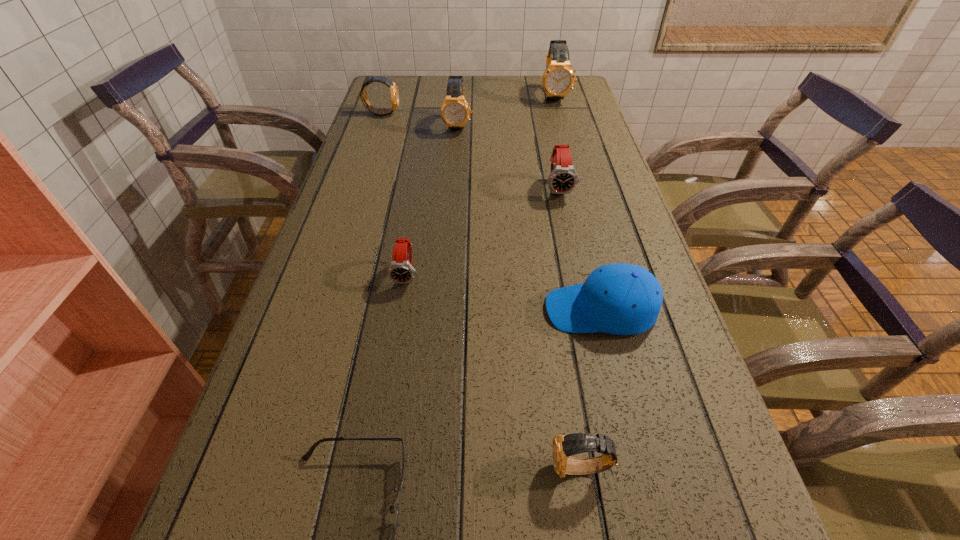
This screenshot has width=960, height=540. I want to click on the smallest gold watch, so click(563, 447).

You are a GUI agent. You are given a task and a screenshot of the screen. Output one action in this format:
    pyautogui.click(x=<x>, y=<y>)
    Task: Click on the fifth farthest watch
    
    Given the screenshot: What is the action you would take?
    pyautogui.click(x=400, y=270)

Locate an element on the screen. The image size is (960, 540). the smaller red watch is located at coordinates (400, 270).

Find the location of `vacant space located 0.090m on the face of the farthest object`. vacant space located 0.090m on the face of the farthest object is located at coordinates (561, 120).

Image resolution: width=960 pixels, height=540 pixels. In order to click on vacant space located 0.110m on the face of the second gold watch from left to right in this screenshot , I will do `click(456, 156)`.

In order to click on free space located on the face of the second smallest gold watch in this screenshot , I will do `click(442, 113)`.

This screenshot has width=960, height=540. Find the location of `free space located 0.210m on the face of the farther red watch`. free space located 0.210m on the face of the farther red watch is located at coordinates (573, 259).

What are the coordinates of `blank space located 0.160m on the front-facing side of the blue cap` in the screenshot? It's located at (466, 310).

At what (x,y) coordinates should I click in order to perform the action: click on vacant space situated on the front-facing side of the blue cap. Please return your answer as a coordinate pair (x, y). Looking at the image, I should click on (500, 310).

Where is `vacant space located 0.360m on the front-facing side of the blue cap`? The height and width of the screenshot is (540, 960). vacant space located 0.360m on the front-facing side of the blue cap is located at coordinates (367, 310).